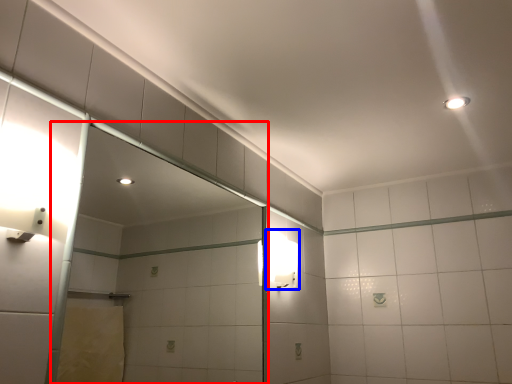
Question: Which of the following is the closest to the observer, glass door (highlighted by a red box) or light fixture (highlighted by a blue box)?

Choices:
 (A) glass door
 (B) light fixture

Answer: (A)